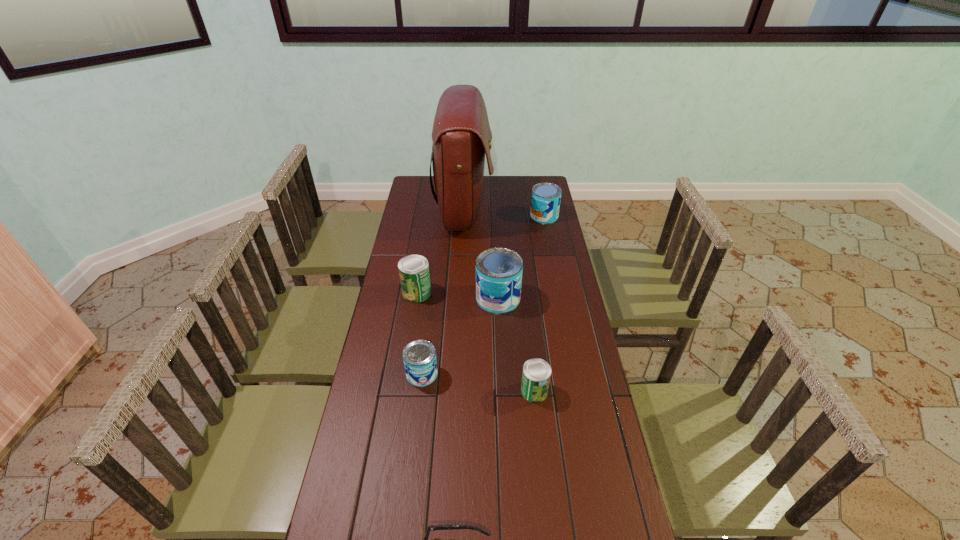
Identify the location of blank region between the smaller green can and the farthest blue can. (540, 303).

Identify which object is located as the fifth nearest to the farthest can. Please provide its 2D coordinates. Your answer should be formatted as a tuple, i.e. [(x, y)], where the tuple contains the x and y coordinates of a point satisfying the conditions above.

[(419, 356)]

Locate an element on the screen. The height and width of the screenshot is (540, 960). the fourth closest object to the right green can is located at coordinates (414, 274).

Find the location of a particular element. can that is the third closest to the satchel is located at coordinates (499, 271).

Find the location of a particular element. The height and width of the screenshot is (540, 960). the third closest can to the satchel is located at coordinates (499, 271).

This screenshot has height=540, width=960. Find the location of `the closest blue can to the second farthest blue can`. the closest blue can to the second farthest blue can is located at coordinates (419, 356).

Find the location of a particular element. This screenshot has width=960, height=540. the second closest blue can to the leftmost blue can is located at coordinates (545, 201).

Locate an element on the screen. The width and height of the screenshot is (960, 540). blank space that satisfies the following two spatial constraints: 1. on the back side of the leftmost blue can; 2. on the left side of the rightmost object is located at coordinates (441, 216).

Locate an element on the screen. The width and height of the screenshot is (960, 540). vacant space that satisfies the following two spatial constraints: 1. on the back side of the farthest blue can; 2. on the left side of the sixth shortest object is located at coordinates click(494, 216).

Identify the location of blank space that satisfies the following two spatial constraints: 1. on the open flap of the satchel; 2. on the back side of the right green can. (454, 391).